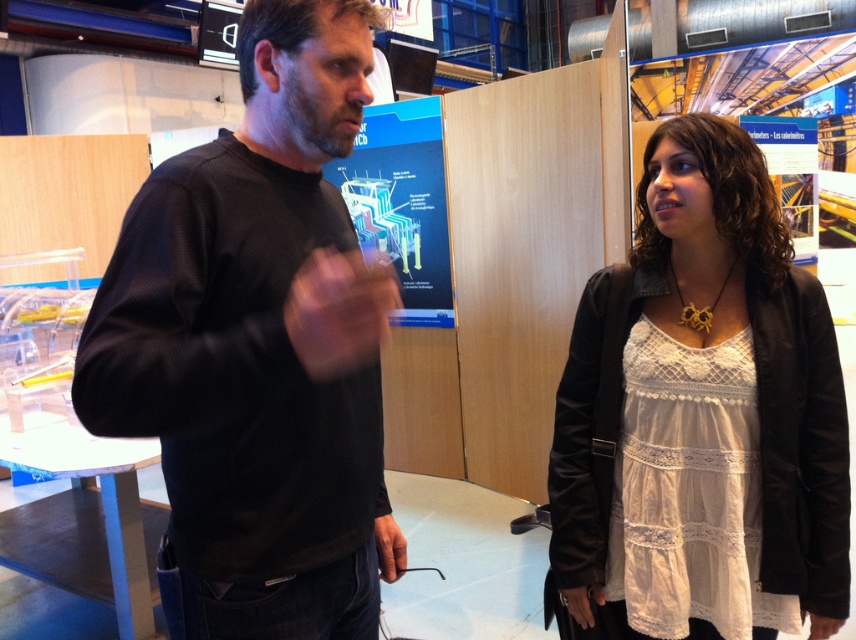
Is black matte sweater at left closer to the viewer compared to white lace dress at center?

Yes, it is in front of white lace dress at center.

The image size is (856, 640). What do you see at coordinates (257, 348) in the screenshot?
I see `black matte sweater at left` at bounding box center [257, 348].

Locate an element on the screen. The width and height of the screenshot is (856, 640). black matte sweater at left is located at coordinates pyautogui.click(x=257, y=348).